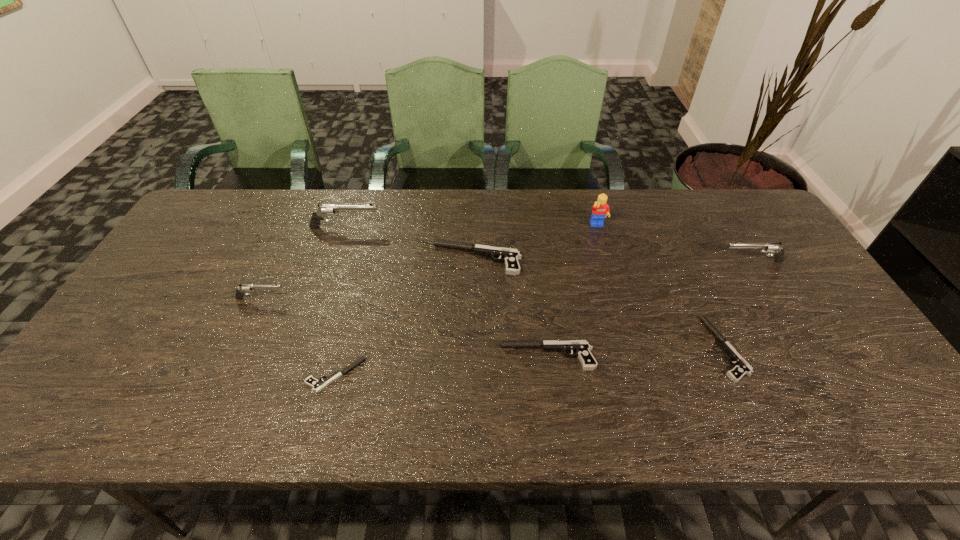
Locate an element on the screen. vacant space at the near right corner is located at coordinates (837, 396).

You are a GUI agent. You are given a task and a screenshot of the screen. Output one action in this format:
    pyautogui.click(x=<x>, y=<y>)
    Task: Click on the vacant space that is in between the second biggest black pistol and the second tallest object
    This screenshot has width=960, height=540.
    Given the screenshot: What is the action you would take?
    pyautogui.click(x=446, y=292)

I want to click on free space between the rightmost pistol and the second shortest pistol, so click(739, 305).

Find the location of a particular element. Image resolution: width=960 pixels, height=540 pixels. free space that is in between the third biggest black pistol and the fourth shortest object is located at coordinates (602, 304).

In order to click on vacant region between the second pistol from right to left and the fourth farthest pistol in this screenshot , I will do `click(493, 323)`.

Where is `unoccupied position between the rightmost pistol and the third object from right to left`? The image size is (960, 540). unoccupied position between the rightmost pistol and the third object from right to left is located at coordinates (675, 244).

The image size is (960, 540). What are the coordinates of `free space between the fourth nearest pistol and the farthest black pistol` in the screenshot? It's located at (369, 279).

At what (x,y) coordinates should I click in order to perform the action: click on vacant space that is in between the rightmost black pistol and the nearest silver pistol. Please return your answer as a coordinate pair (x, y). The image size is (960, 540). Looking at the image, I should click on (493, 323).

At what (x,y) coordinates should I click in order to perform the action: click on free space between the sixth tallest object and the second shortest object. Please return your answer as a coordinate pair (x, y). This screenshot has height=540, width=960. Looking at the image, I should click on (636, 353).

Where is `free space between the rightmost silver pistol and the farthest pistol`? free space between the rightmost silver pistol and the farthest pistol is located at coordinates (549, 245).